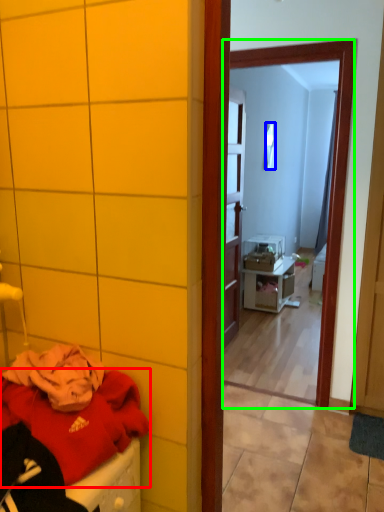
Question: Estimate the real-world distances between objects in this image. Which object is closer to clothing (highlighted by a red box), mirror (highlighted by a blue box) or mirror (highlighted by a green box)?

Choices:
 (A) mirror
 (B) mirror

Answer: (B)